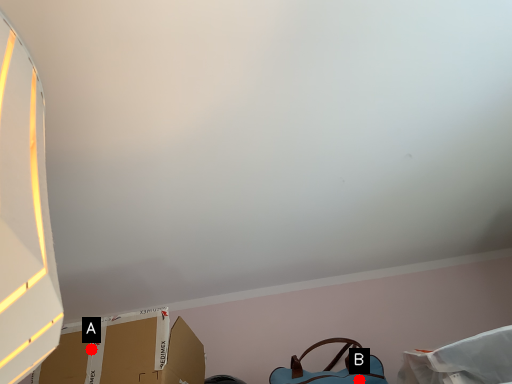
Question: Two points are circled on the image, labeled by A and B beside each circle. Among these points, which one is farthest from the camera?

Choices:
 (A) A is further
 (B) B is further

Answer: (B)